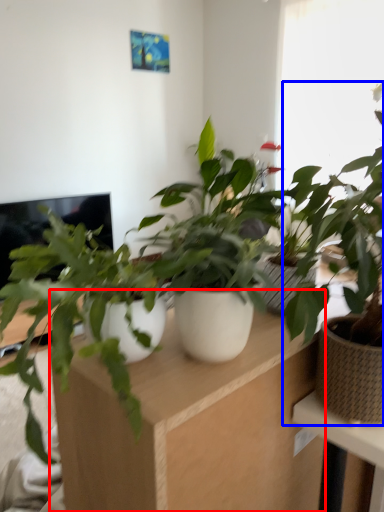
Question: Which point is closer to the camera, computer desk (highlighted by a red box) or houseplant (highlighted by a blue box)?

Choices:
 (A) computer desk
 (B) houseplant

Answer: (A)